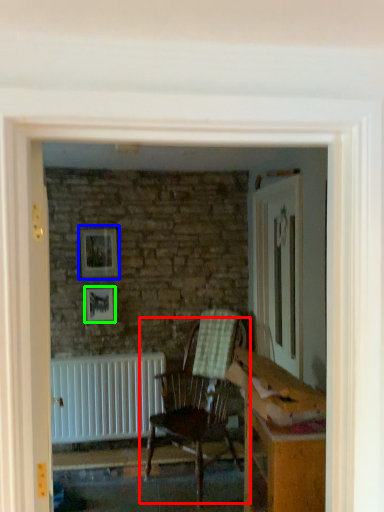
Question: Based on their relative distances, which object is farther from chair (highlighted by a red box)? Choose from picture frame (highlighted by a blue box) and picture frame (highlighted by a green box).

Choices:
 (A) picture frame
 (B) picture frame

Answer: (A)